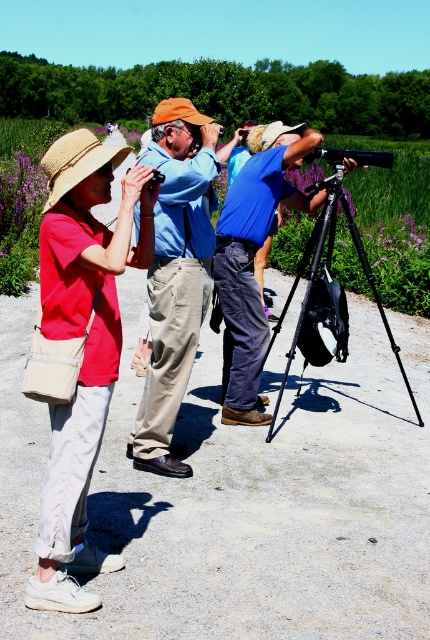
Question: Is matte blue shirt at center wider than black tripod at center?

Choices:
 (A) yes
 (B) no

Answer: (A)

Question: Which point is farther from the camera taking this photo?

Choices:
 (A) (242, 244)
 (B) (212, 131)
 (C) (144, 230)
 (D) (301, 332)

Answer: (D)

Question: Is blue fabric shirt at center wider than black tripod at center?

Choices:
 (A) no
 (B) yes

Answer: (A)

Question: Does matte straw hat at left appear over blue fabric shirt at center?

Choices:
 (A) yes
 (B) no

Answer: (B)

Question: Based on their relative distances, which object is nearer to the matte blue shirt at center?

Choices:
 (A) blue fabric shirt at center
 (B) black tripod at center
 (C) matte straw hat at left

Answer: (A)

Question: Which of the following is the closest to the observer?

Choices:
 (A) black tripod at center
 (B) matte blue shirt at center
 (C) matte straw hat at left
 (D) blue fabric shirt at center

Answer: (C)